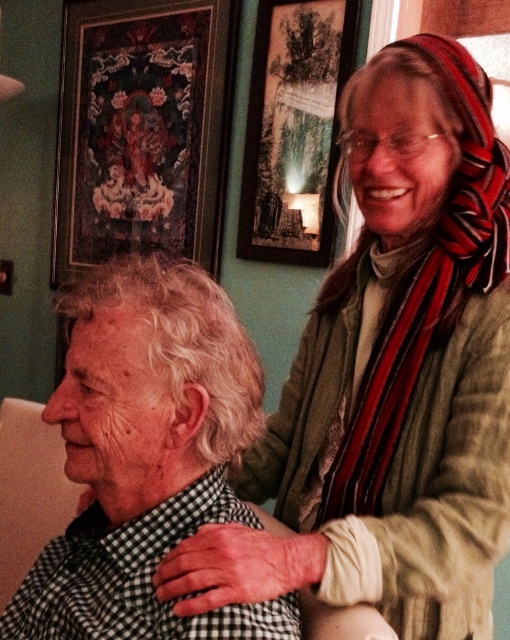
Question: Which object is positioned closest to the wooden framed artwork at upper left?

Choices:
 (A) wooden framed picture at upper center
 (B) checkered fabric shirt at center

Answer: (A)

Question: Estimate the real-world distances between objects in this image. Which object is farther from the checkered fabric shirt at center?

Choices:
 (A) wooden framed picture at upper center
 (B) wooden framed artwork at upper left

Answer: (B)

Question: Which of the following is the farthest from the observer?

Choices:
 (A) wooden framed artwork at upper left
 (B) wooden framed picture at upper center

Answer: (A)

Question: Is checkered fabric shirt at center positioned at the back of wooden framed picture at upper center?

Choices:
 (A) no
 (B) yes

Answer: (A)

Question: Is checkered fabric shirt at center below wooden framed artwork at upper left?

Choices:
 (A) yes
 (B) no

Answer: (A)

Question: Does checkered fabric shirt at center have a greater width compared to wooden framed artwork at upper left?

Choices:
 (A) yes
 (B) no

Answer: (B)